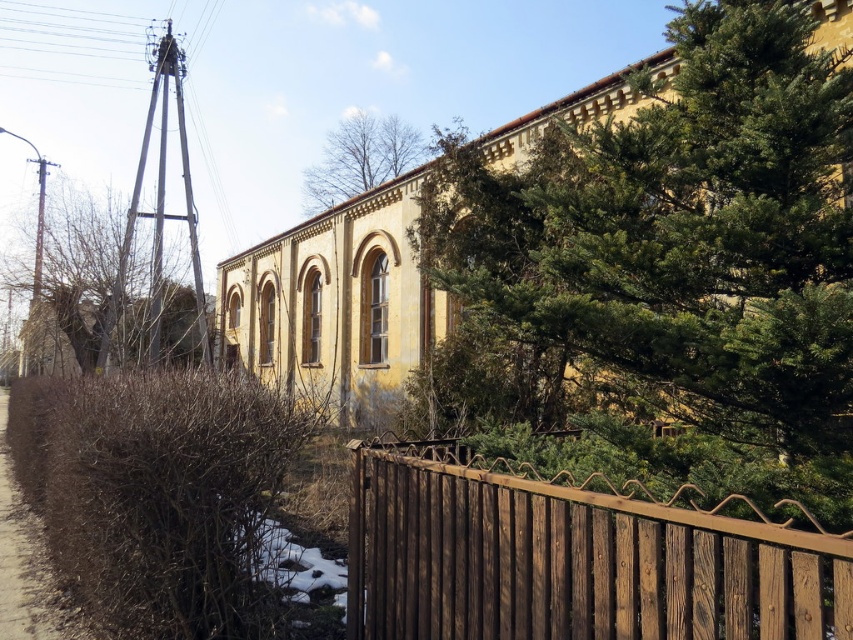
Between green leafy tree at upper right and brown dirt at left, which one is positioned higher?

green leafy tree at upper right is above.

Measure the distance between point (x=583, y=209) and camera.

A distance of 3.62 meters exists between point (x=583, y=209) and camera.

Between point (804, 125) and point (38, 628), which one is positioned behind?

Positioned behind is point (38, 628).

I want to click on green leafy tree at upper right, so click(671, 262).

Is brown textured tree at left below bare branches at upper center?

Correct, brown textured tree at left is located below bare branches at upper center.

Looking at this image, who is shorter, brown textured tree at left or bare branches at upper center?

bare branches at upper center

At what (x,y) coordinates should I click in order to perform the action: click on brown textured tree at left. Please return your answer as a coordinate pair (x, y). The image size is (853, 640). Looking at the image, I should click on (86, 284).

Locate an element on the screen. The width and height of the screenshot is (853, 640). brown textured tree at left is located at coordinates (86, 284).

Based on the photo, is green leafy tree at upper right thinner than brown wooden fence at lower right?

No.

Between green leafy tree at upper right and brown wooden fence at lower right, which one appears on the right side from the viewer's perspective?

green leafy tree at upper right

Does point (775, 84) lie in front of point (543, 570)?

That is False.

What are the coordinates of `green leafy tree at upper right` in the screenshot? It's located at (671, 262).